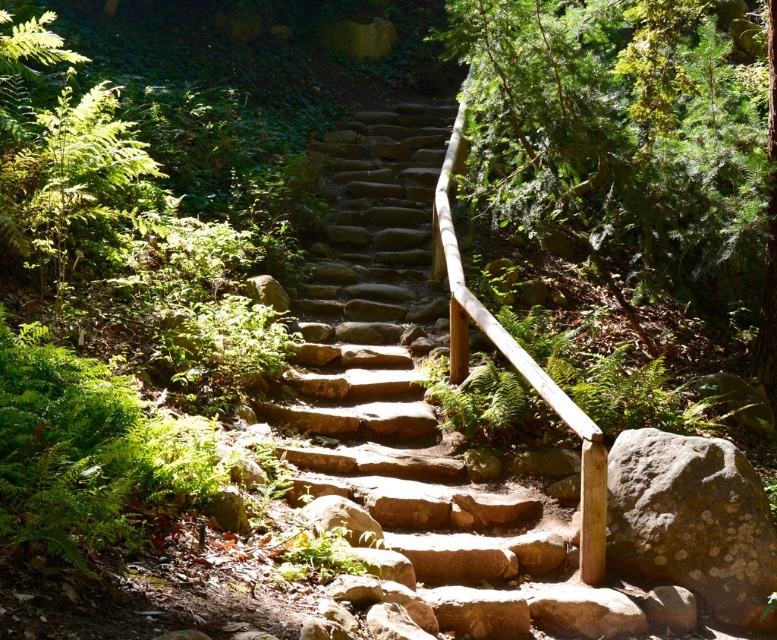
You are standing on the natural stone staircase in the forest. You see two points marked on the path. The first point is at coordinate point [476,602] and the second is at point [685,477]. If you are facing up the staircase, which point is closer to you?

Point [476,602] is in front of point [685,477], so when facing up the staircase, point [476,602] is closer to you.

You are hiking and need to climb up the natural stone stairs at center. There is a gray rough rock at lower right nearby. Which object is higher in elevation?

The natural stone stairs at center is higher in elevation than the gray rough rock at lower right.

You are hiking and want to take a photo of the natural stone stairs at center and the gray rough rock at lower right. Which object should you focus on first to ensure both are in frame?

You should focus on the natural stone stairs at center first because it is closer to you than the gray rough rock at lower right, so adjusting the camera to include both would require framing starting from the closer object.